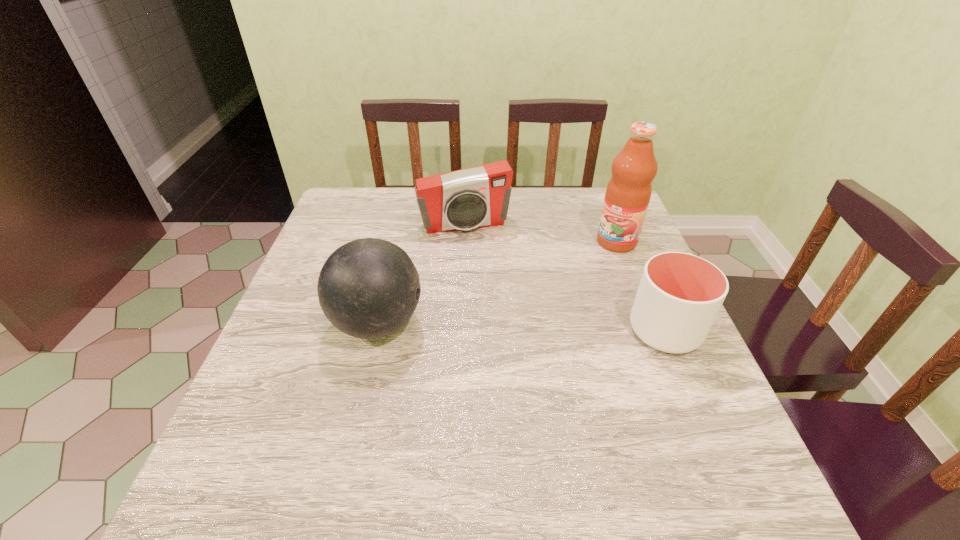
Identify which object is located as the second nearest to the tallest object. Please provide its 2D coordinates. Your answer should be formatted as a tuple, i.e. [(x, y)], where the tuple contains the x and y coordinates of a point satisfying the conditions above.

[(475, 197)]

Select which object is the closest to the cup. Please provide its 2D coordinates. Your answer should be formatted as a tuple, i.e. [(x, y)], where the tuple contains the x and y coordinates of a point satisfying the conditions above.

[(628, 193)]